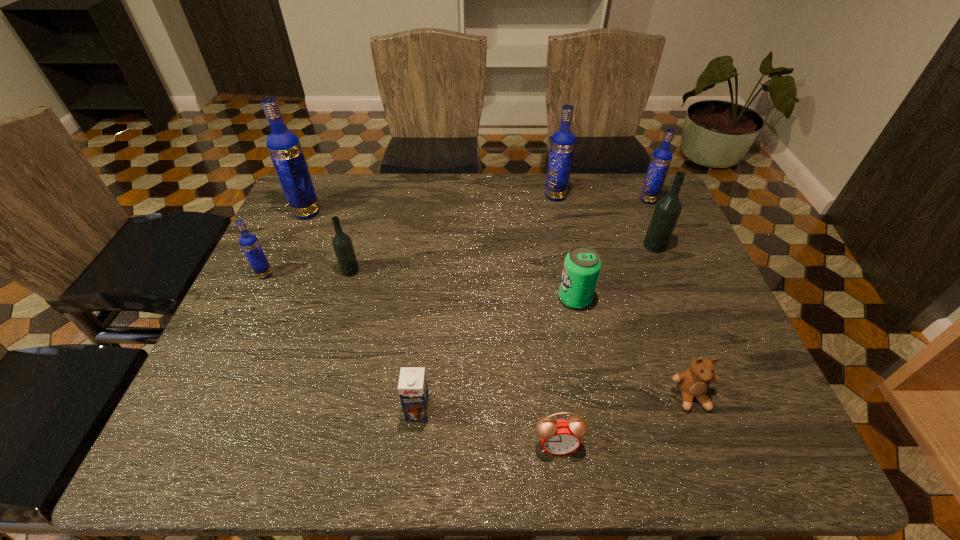
You are a GUI agent. You are given a task and a screenshot of the screen. Output one action in this format:
    pyautogui.click(x=<x>, y=<y>)
    Task: Click on the pop soda
    The width and height of the screenshot is (960, 540).
    Given the screenshot: What is the action you would take?
    pyautogui.click(x=582, y=265)

The image size is (960, 540). Find the location of `the seventh object from right to left`. the seventh object from right to left is located at coordinates (413, 390).

Image resolution: width=960 pixels, height=540 pixels. I want to click on the sixth object from right to left, so click(x=559, y=437).

You are a GUI agent. You are given a task and a screenshot of the screen. Output one action in this format:
    pyautogui.click(x=<x>, y=<y>)
    Task: Click on the nearest object
    
    Given the screenshot: What is the action you would take?
    pyautogui.click(x=559, y=437)

The width and height of the screenshot is (960, 540). I want to click on brown teddy bear, so click(694, 382).

What are the coordinates of `blank space located 0.370m on the right of the tallest vodka` in the screenshot? It's located at (439, 212).

This screenshot has height=540, width=960. Identify the location of free space located 0.320m on the front of the third vodka from right to left. (571, 274).

Locate an element on the screen. This screenshot has width=960, height=540. vacant space located 0.360m on the left of the rightmost blue vodka is located at coordinates (528, 200).

The height and width of the screenshot is (540, 960). I want to click on free location located 0.310m on the back of the right black vodka, so click(627, 179).

Image resolution: width=960 pixels, height=540 pixels. I want to click on vacant region located 0.250m on the back of the nearest blue vodka, so click(x=294, y=212).